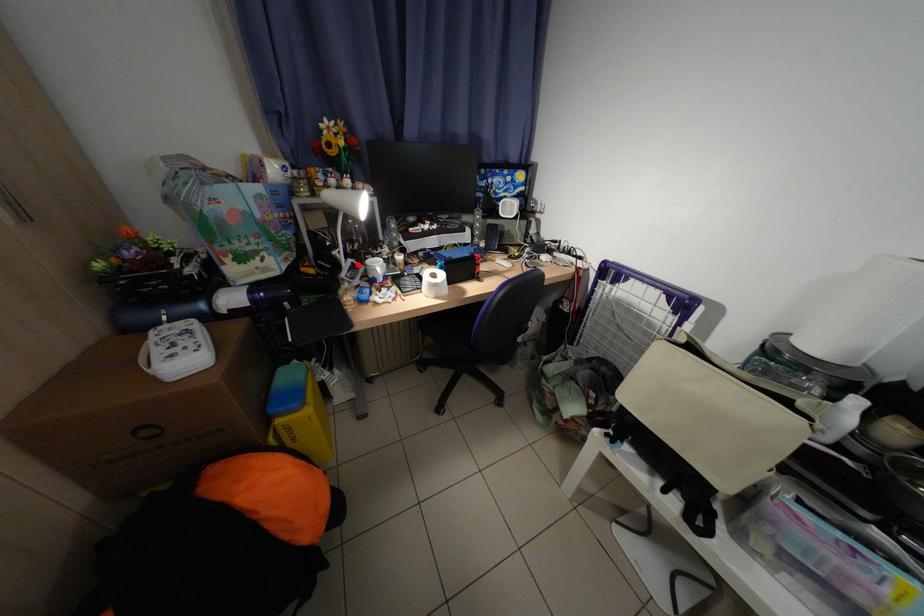
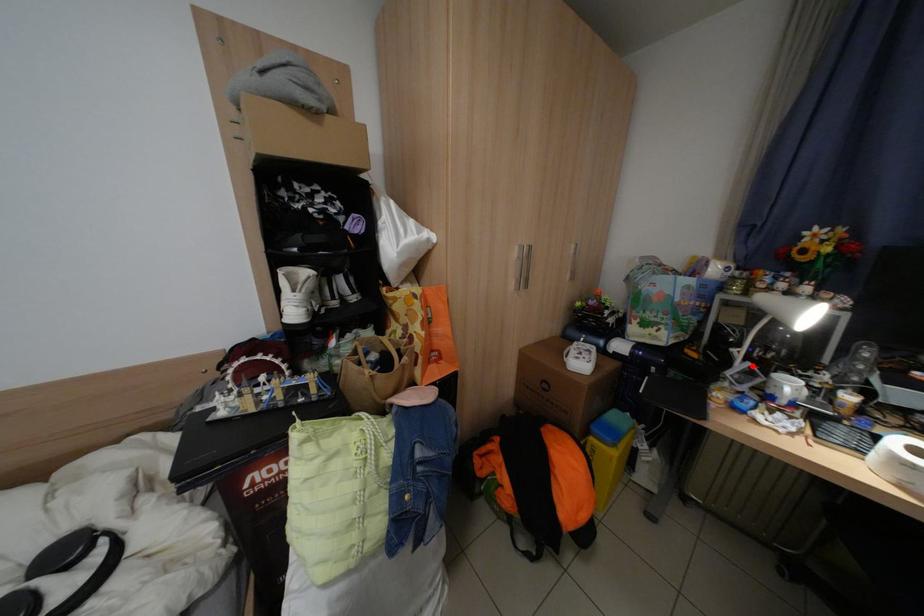
I am providing you with two images of the same scene from different viewpoints. A red point is marked on the first image and another point is marked on the second image. Do the highlighted points in image1 and image2 indicate the same real-world spot?

Yes